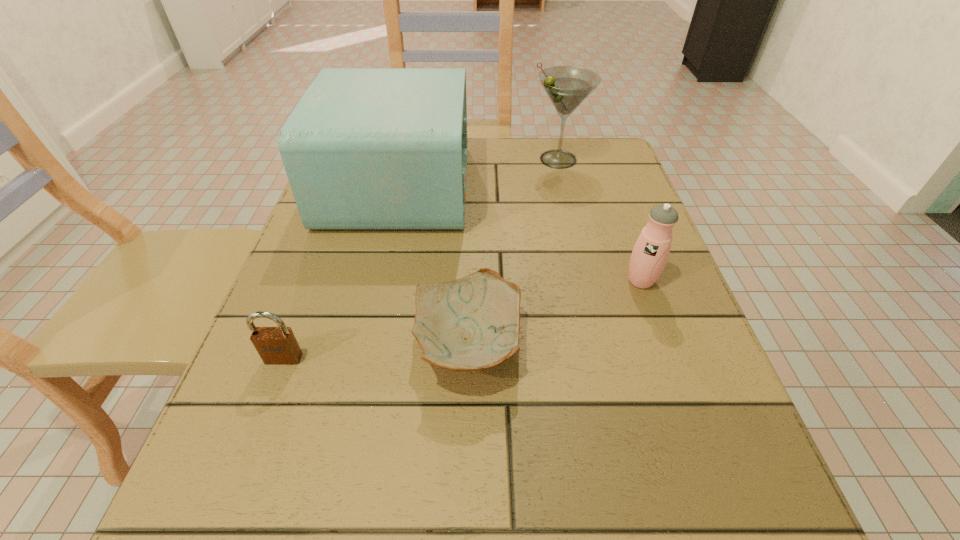
Where is `free space at the near edge`? free space at the near edge is located at coordinates (401, 511).

Locate an element on the screen. vacant point at the left edge is located at coordinates (229, 445).

Identify the location of vacant space at the right edge. The image size is (960, 540). (612, 315).

Identify the location of vacant space at the near left corner. Image resolution: width=960 pixels, height=540 pixels. (192, 516).

The width and height of the screenshot is (960, 540). Identify the location of vacant region at the far right corner of the desktop. (578, 143).

This screenshot has height=540, width=960. I want to click on free space between the third farthest object and the pottery, so click(555, 312).

This screenshot has height=540, width=960. I want to click on free spot between the martini and the pottery, so click(513, 252).

What are the coordinates of `vacant space in between the padlock and the martini` in the screenshot? It's located at (420, 259).

This screenshot has width=960, height=540. Find the location of `free space between the third nearest object and the martini`. free space between the third nearest object and the martini is located at coordinates (599, 220).

This screenshot has width=960, height=540. I want to click on vacant area that lies between the radio receiver and the shortest object, so click(x=433, y=265).